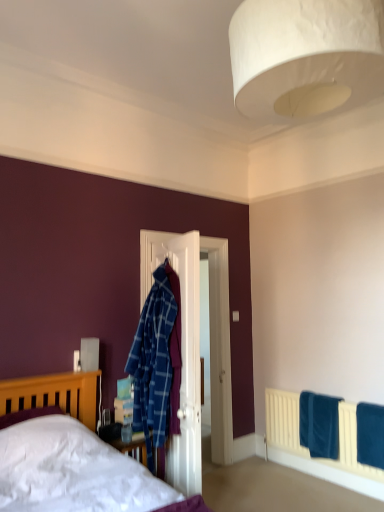
Question: Considering the relative sizes of white wooden door at center and white paper lampshade at upper center in the image provided, is white wooden door at center bigger than white paper lampshade at upper center?

Choices:
 (A) yes
 (B) no

Answer: (A)

Question: Is white wooden door at center shorter than white paper lampshade at upper center?

Choices:
 (A) yes
 (B) no

Answer: (B)

Question: Is white wooden door at center not close to white paper lampshade at upper center?

Choices:
 (A) no
 (B) yes

Answer: (B)

Question: Are white wooden door at center and white paper lampshade at upper center beside each other?

Choices:
 (A) yes
 (B) no

Answer: (B)

Question: Considering the relative sizes of white wooden door at center and white paper lampshade at upper center in the image provided, is white wooden door at center thinner than white paper lampshade at upper center?

Choices:
 (A) yes
 (B) no

Answer: (A)

Question: From a real-world perspective, relative to white paper lampshade at upper center, is matte wooden bed at lower left vertically above or below?

Choices:
 (A) below
 (B) above

Answer: (A)

Question: Would you say matte wooden bed at lower left is inside or outside white paper lampshade at upper center?

Choices:
 (A) inside
 (B) outside

Answer: (B)

Question: From the image's perspective, relative to white paper lampshade at upper center, is matte wooden bed at lower left above or below?

Choices:
 (A) below
 (B) above

Answer: (A)

Question: In the image, is matte wooden bed at lower left on the left side or the right side of white paper lampshade at upper center?

Choices:
 (A) left
 (B) right

Answer: (A)

Question: In terms of size, does white wooden door at center appear bigger or smaller than blue soft towel at lower right, the first bath towel when ordered from front to back?

Choices:
 (A) big
 (B) small

Answer: (A)

Question: Is white wooden door at center wider or thinner than blue soft towel at lower right, the first bath towel from the right?

Choices:
 (A) wide
 (B) thin

Answer: (B)

Question: From a real-world perspective, is white wooden door at center above or below blue soft towel at lower right, which is the second bath towel in back-to-front order?

Choices:
 (A) above
 (B) below

Answer: (A)

Question: Is white wooden door at center to the left or to the right of blue soft towel at lower right, the second bath towel in the left-to-right sequence, in the image?

Choices:
 (A) right
 (B) left

Answer: (B)

Question: Is point (375, 436) closer or farther from the camera than point (312, 443)?

Choices:
 (A) closer
 (B) farther

Answer: (A)

Question: Is blue soft towel at lower right, the first bath towel from the right, taller or shorter than blue soft towel at lower right, which appears as the 1th bath towel when viewed from the back?

Choices:
 (A) short
 (B) tall

Answer: (B)